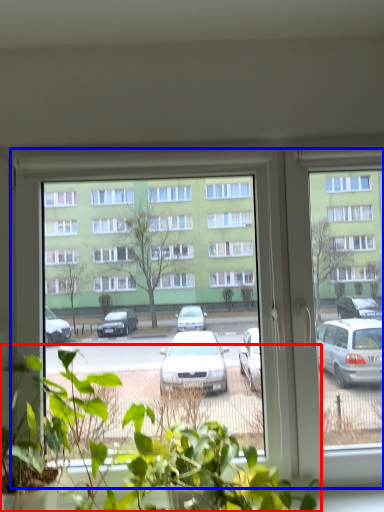
Question: Which point is closer to the camera, houseplant (highlighted by a red box) or window (highlighted by a blue box)?

Choices:
 (A) houseplant
 (B) window

Answer: (A)